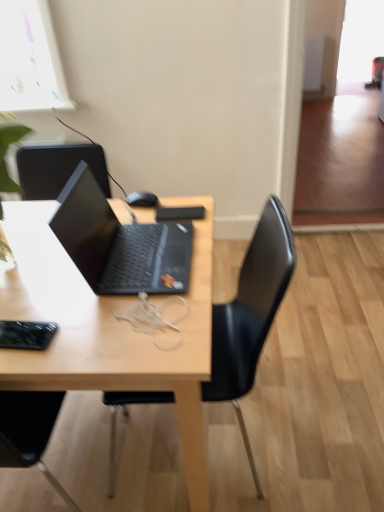
Question: From a real-world perspective, is matte black laptop at center positioned over transparent glass window at upper right based on gravity?

Choices:
 (A) no
 (B) yes

Answer: (B)

Question: Is matte black laptop at center looking in the opposite direction of transparent glass window at upper right?

Choices:
 (A) yes
 (B) no

Answer: (B)

Question: Is matte black laptop at center not near transparent glass window at upper right?

Choices:
 (A) yes
 (B) no

Answer: (A)

Question: Is matte black laptop at center behind transparent glass window at upper right?

Choices:
 (A) yes
 (B) no

Answer: (B)

Question: Does matte black laptop at center have a greater width compared to transparent glass window at upper right?

Choices:
 (A) no
 (B) yes

Answer: (B)

Question: Is matte black laptop at center oriented towards transparent glass window at upper right?

Choices:
 (A) no
 (B) yes

Answer: (A)

Question: Considering the relative sizes of black matte mouse at center and wooden desk at center in the image provided, is black matte mouse at center taller than wooden desk at center?

Choices:
 (A) yes
 (B) no

Answer: (B)

Question: Can you confirm if black matte mouse at center is thinner than wooden desk at center?

Choices:
 (A) no
 (B) yes

Answer: (B)

Question: Can you see black matte mouse at center touching wooden desk at center?

Choices:
 (A) no
 (B) yes

Answer: (A)

Question: Considering the relative positions of black matte mouse at center and wooden desk at center in the image provided, is black matte mouse at center to the left of wooden desk at center from the viewer's perspective?

Choices:
 (A) no
 (B) yes

Answer: (A)

Question: From the image's perspective, is black matte mouse at center below wooden desk at center?

Choices:
 (A) no
 (B) yes

Answer: (A)

Question: Is the depth of black matte mouse at center greater than that of wooden desk at center?

Choices:
 (A) yes
 (B) no

Answer: (A)

Question: Does wooden desk at center have a lesser height compared to black matte mouse at center?

Choices:
 (A) yes
 (B) no

Answer: (B)